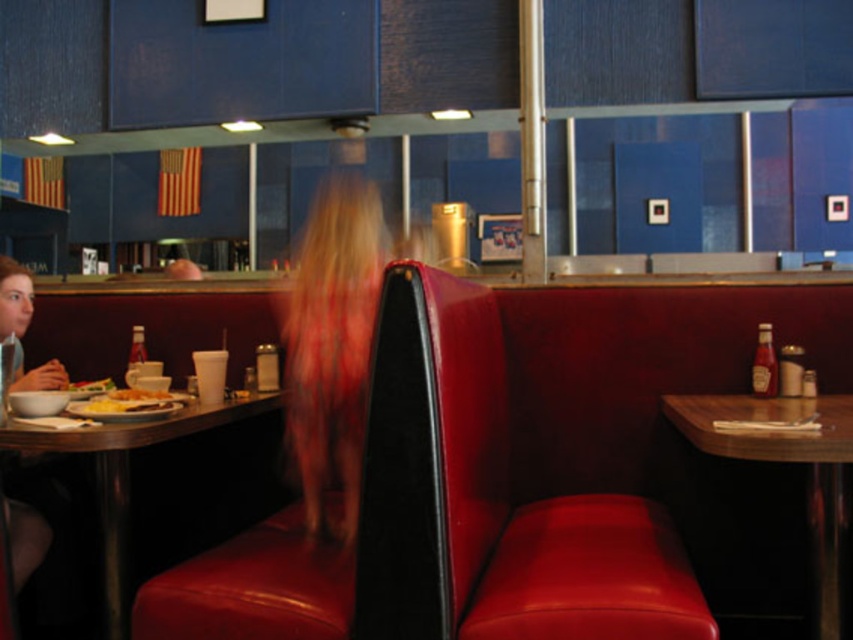
Which of these two, velvet red booth at center or blurred blonde hair at center, stands taller?

With more height is blurred blonde hair at center.

Is point (461, 509) positioned behind point (343, 513)?

No, (461, 509) is closer to viewer.

The image size is (853, 640). Find the location of `velvet red booth at center`. velvet red booth at center is located at coordinates (489, 500).

Does blurred blonde hair at center appear on the right side of matte plastic table at left?

Indeed, blurred blonde hair at center is positioned on the right side of matte plastic table at left.

Is blurred blonde hair at center to the left of matte plastic table at left from the viewer's perspective?

Incorrect, blurred blonde hair at center is not on the left side of matte plastic table at left.

Between point (337, 429) and point (144, 429), which one is positioned in front?

Point (144, 429)

Find the location of `blurred blonde hair at center`. blurred blonde hair at center is located at coordinates (332, 342).

Is wooden table at right thinner than matte plastic table at left?

No.

Can you confirm if wooden table at right is positioned to the left of matte plastic table at left?

Incorrect, wooden table at right is not on the left side of matte plastic table at left.

Is point (844, 481) less distant than point (199, 416)?

That is True.

Where is `wooden table at right`? The height and width of the screenshot is (640, 853). wooden table at right is located at coordinates pyautogui.click(x=787, y=461).